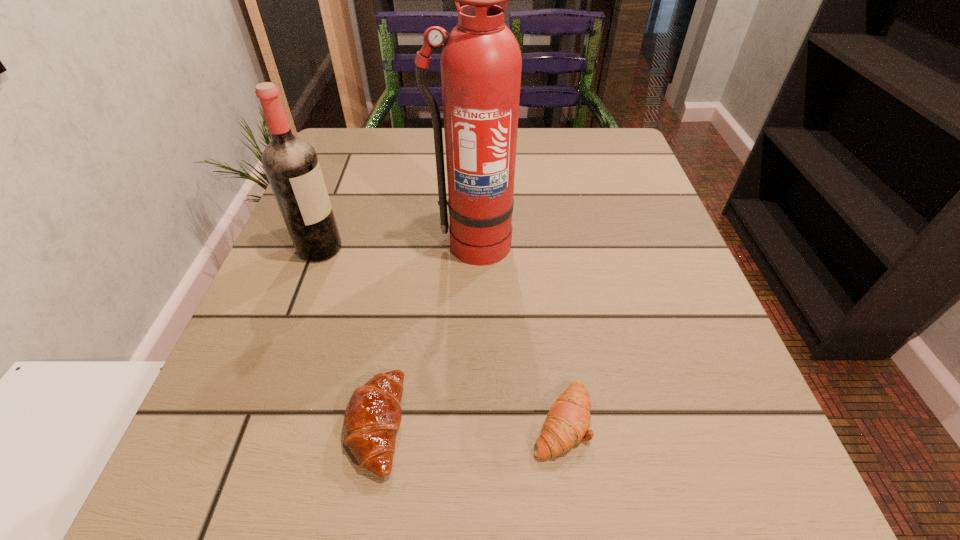
Find the location of `fire extinguisher`. fire extinguisher is located at coordinates (481, 63).

Where is `the third object from left to right`? This screenshot has width=960, height=540. the third object from left to right is located at coordinates (481, 63).

You are a GUI agent. You are given a task and a screenshot of the screen. Output one action in this format:
    pyautogui.click(x=<x>, y=<y>)
    Task: Click on the liquor
    
    Given the screenshot: What is the action you would take?
    pyautogui.click(x=291, y=164)

At what (x,y) coordinates should I click in order to perform the action: click on the leftmost object. Please return your answer as a coordinate pair (x, y). Image resolution: width=960 pixels, height=540 pixels. Looking at the image, I should click on (291, 164).

Image resolution: width=960 pixels, height=540 pixels. I want to click on the taller crescent roll, so click(x=373, y=414).

Identify the location of the third tallest object. (373, 414).

At what (x,y) coordinates should I click in order to perform the action: click on the rightmost object. Please return your answer as a coordinate pair (x, y). The width and height of the screenshot is (960, 540). Looking at the image, I should click on (568, 420).

Find the location of a particular element. The width and height of the screenshot is (960, 540). the shorter crescent roll is located at coordinates (568, 420).

The width and height of the screenshot is (960, 540). Find the location of `vacant space located 0.340m on the label side of the tallest object`. vacant space located 0.340m on the label side of the tallest object is located at coordinates (468, 450).

At what (x,y) coordinates should I click in order to perform the action: click on vacant space situated 0.310m on the front-facing side of the leftmost object. Please return your answer as a coordinate pair (x, y). The height and width of the screenshot is (540, 960). Looking at the image, I should click on (505, 248).